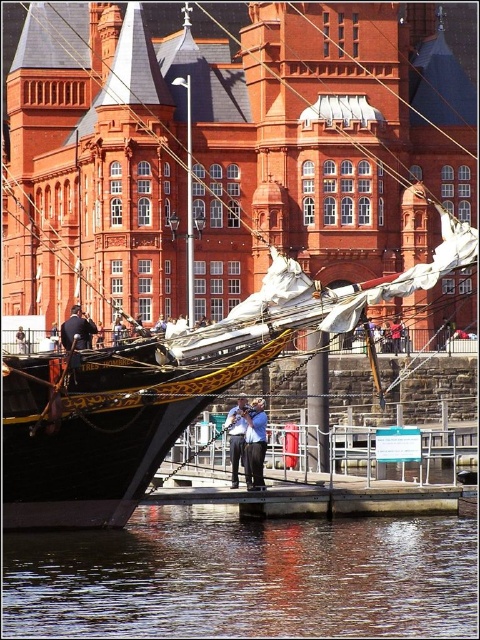
Question: Considering the real-world distances, which object is farthest from the blue shirt at center?

Choices:
 (A) dark blue jeans at lower left
 (B) smooth reflective water at lower center

Answer: (B)

Question: Which object appears farthest from the camera in this image?

Choices:
 (A) smooth reflective water at lower center
 (B) blue shirt at center
 (C) blue fabric shirt at center

Answer: (B)

Question: Observing the image, what is the correct spatial positioning of blue fabric shirt at center in reference to blue shirt at center?

Choices:
 (A) right
 (B) left

Answer: (A)

Question: Among these points, which one is farthest from the camera?

Choices:
 (A) (62, 337)
 (B) (255, 458)
 (C) (238, 426)
 (D) (137, 570)

Answer: (C)

Question: From the image, what is the correct spatial relationship of smooth reflective water at lower center in relation to blue fabric shirt at center?

Choices:
 (A) right
 (B) left

Answer: (B)

Question: Observing the image, what is the correct spatial positioning of smooth reflective water at lower center in reference to dark blue jeans at lower left?

Choices:
 (A) left
 (B) right

Answer: (B)